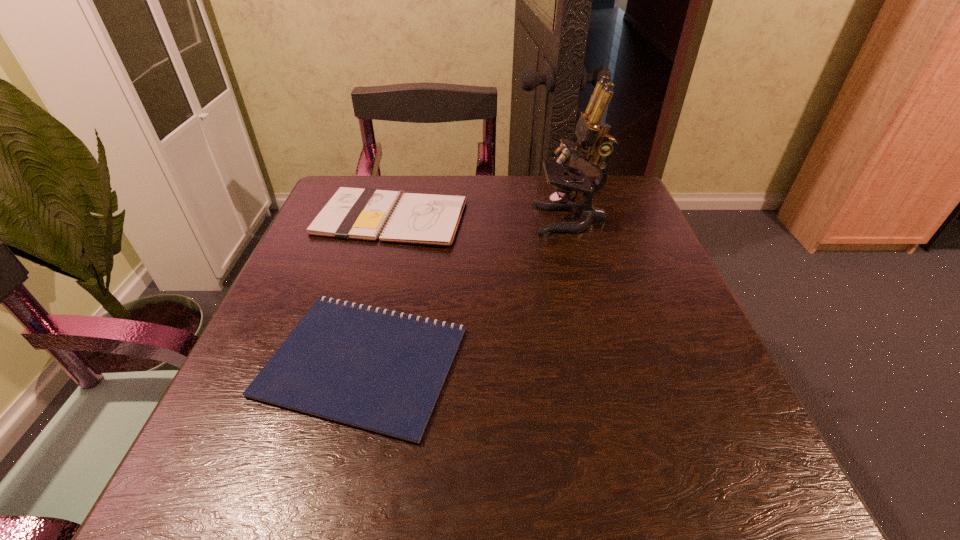
The width and height of the screenshot is (960, 540). I want to click on empty space that is in between the second tallest object and the rightmost object, so click(481, 219).

I want to click on free point between the shortest object and the farther notepad, so click(x=377, y=289).

The width and height of the screenshot is (960, 540). Find the location of `free space between the farther notepad and the microscope`. free space between the farther notepad and the microscope is located at coordinates (481, 219).

Identify the location of object identified as the closest to the taller notepad. (382, 371).

Identify which object is the closest to the second shortest object. Please provide its 2D coordinates. Your answer should be formatted as a tuple, i.e. [(x, y)], where the tuple contains the x and y coordinates of a point satisfying the conditions above.

[(382, 371)]

Identify the location of free space that satisfies the following two spatial constraints: 1. at the eyepieces of the tallest object; 2. on the front side of the shorter notepad. The image size is (960, 540). (609, 361).

Locate an element on the screen. The height and width of the screenshot is (540, 960). vacant space that satisfies the following two spatial constraints: 1. at the eyepieces of the rightmost object; 2. on the front side of the shortest object is located at coordinates (609, 361).